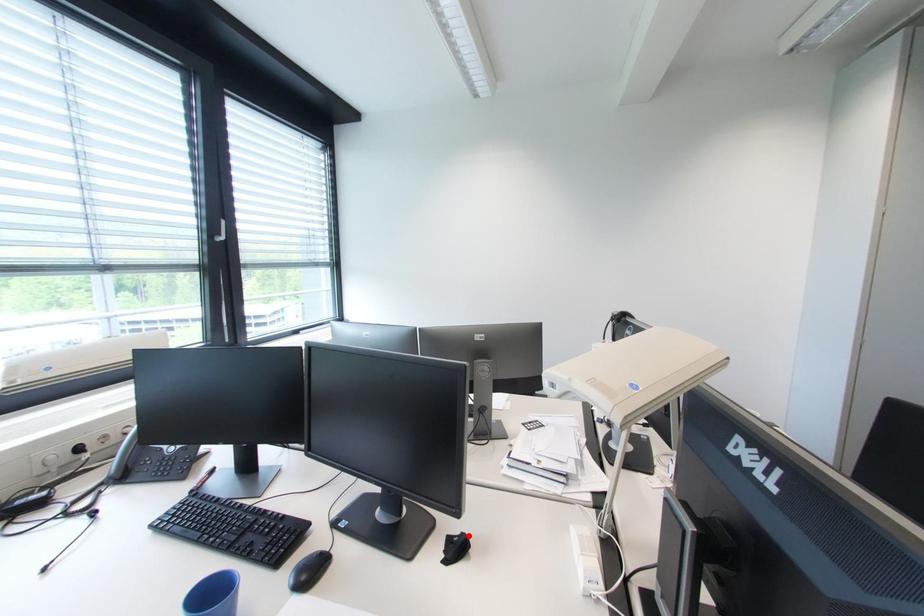
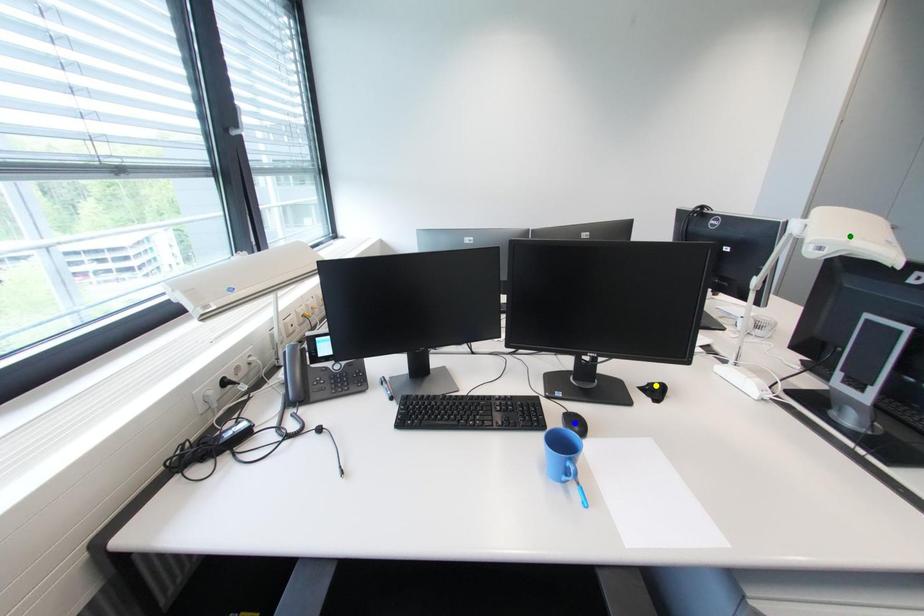
Question: I am providing you with two images of the same scene from different viewpoints. A red point is marked on the first image. You are given multiple points on the second image. In image 2, which mark is for the same physical point as the one in image 1?

Choices:
 (A) yellow point
 (B) blue point
 (C) green point

Answer: (A)